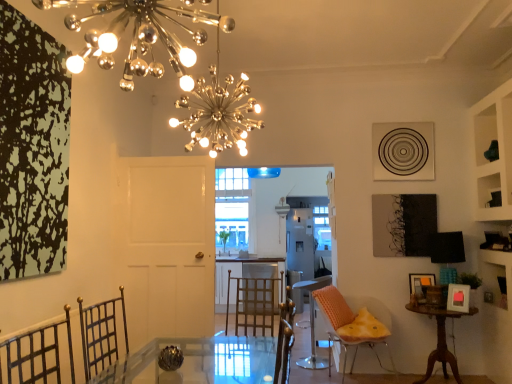
Question: Is orange textured chair at right, arranged as the first chair when viewed from the front, taller or shorter than wooden round table at lower right?

Choices:
 (A) short
 (B) tall

Answer: (B)

Question: Based on their positions, is orange textured chair at right, the second chair viewed from the back, located to the left or right of wooden round table at lower right?

Choices:
 (A) right
 (B) left

Answer: (B)

Question: Which object is the closest to the orange textured cushion at center, the second chair when ordered from front to back?

Choices:
 (A) wooden picture frame at lower right, the first picture frame when ordered from back to front
 (B) orange textured chair at right, the second chair viewed from the back
 (C) white matte door at center
 (D) metallic spherical lights at upper center
 (E) satin white refrigerator at center

Answer: (B)

Question: Which object is the closest to the clear glass window at center?

Choices:
 (A) wooden picture frame at lower right, the first picture frame when ordered from back to front
 (B) orange textured cushion at center, marked as the 1th chair in a back-to-front arrangement
 (C) wooden round table at lower right
 (D) orange textured chair at right, arranged as the first chair when viewed from the front
 (E) pink paper picture frame at lower right, arranged as the second picture frame when viewed from the back

Answer: (B)